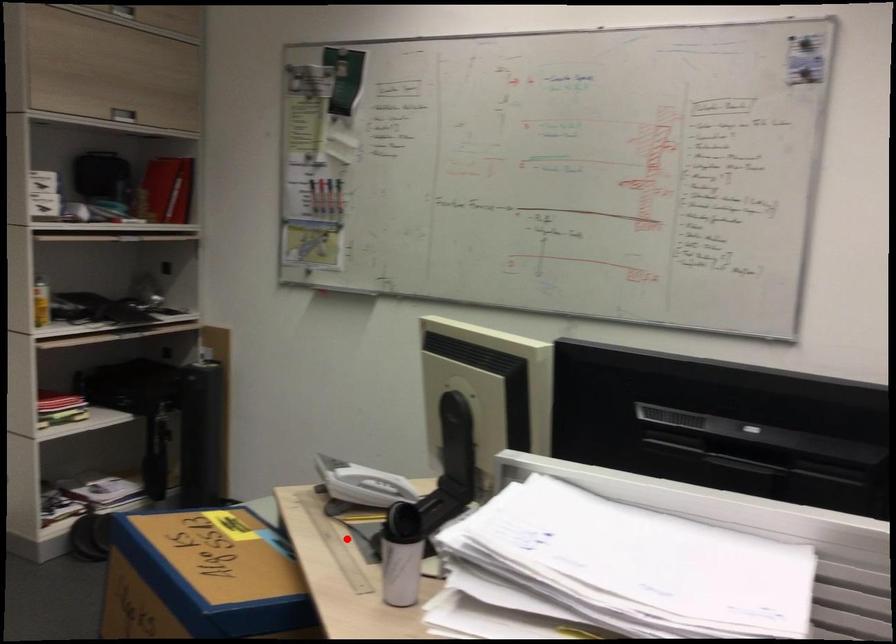
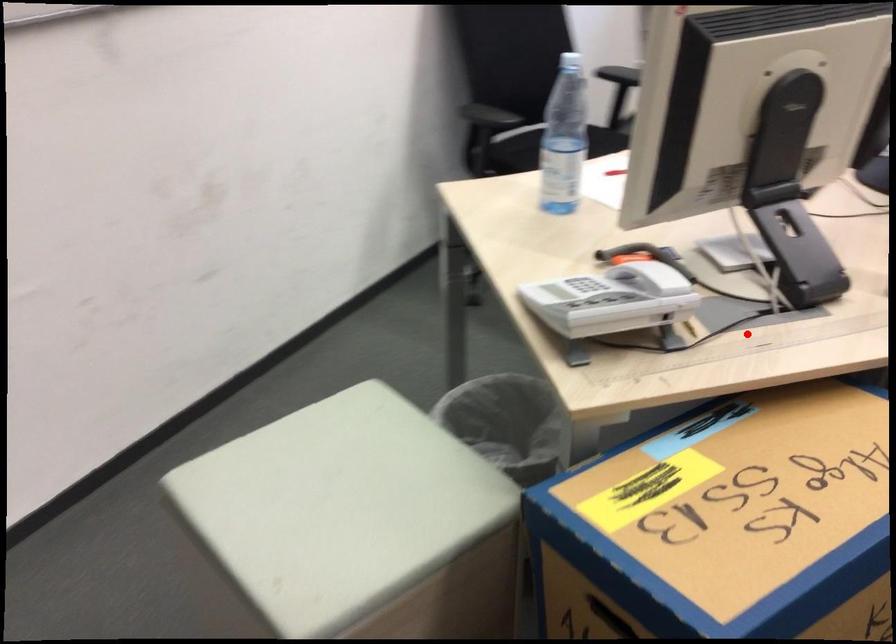
From the picture: I am providing you with two images of the same scene from different viewpoints. A red point is marked on the first image and another point is marked on the second image. Is the red point in image1 aligned with the point shown in image2?

Yes